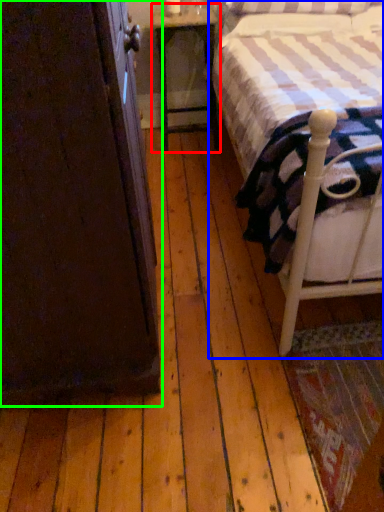
Question: Which object is the closest to the nightstand (highlighted by a red box)? Choose among these: bed (highlighted by a blue box) or armoire (highlighted by a green box).

Choices:
 (A) bed
 (B) armoire

Answer: (A)